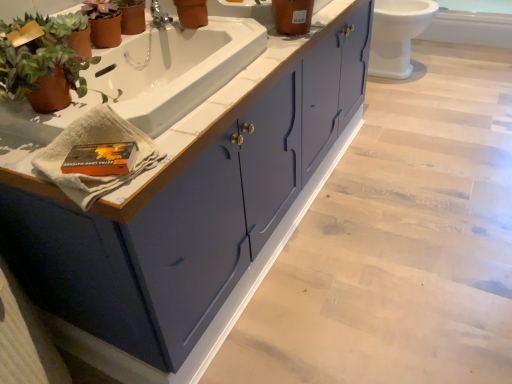
Question: Can you confirm if white glossy toilet at upper right is taller than matte orange pot at upper center?

Choices:
 (A) yes
 (B) no

Answer: (A)

Question: Is white glossy toilet at upper right not within matte orange pot at upper center?

Choices:
 (A) yes
 (B) no

Answer: (A)

Question: Is white glossy toilet at upper right shorter than matte orange pot at upper center?

Choices:
 (A) yes
 (B) no

Answer: (B)

Question: Does white glossy toilet at upper right have a smaller size compared to matte orange pot at upper center?

Choices:
 (A) yes
 (B) no

Answer: (B)

Question: Is white glossy toilet at upper right positioned with its back to matte orange pot at upper center?

Choices:
 (A) no
 (B) yes

Answer: (A)

Question: Considering the positions of white glossy sink at upper center and silver metallic faucet at upper center in the image, is white glossy sink at upper center taller or shorter than silver metallic faucet at upper center?

Choices:
 (A) tall
 (B) short

Answer: (A)

Question: Which is correct: white glossy sink at upper center is inside silver metallic faucet at upper center, or outside of it?

Choices:
 (A) outside
 (B) inside

Answer: (A)

Question: Based on their sizes in the image, would you say white glossy sink at upper center is bigger or smaller than silver metallic faucet at upper center?

Choices:
 (A) small
 (B) big

Answer: (B)

Question: From a real-world perspective, relative to silver metallic faucet at upper center, is white glossy sink at upper center vertically above or below?

Choices:
 (A) below
 (B) above

Answer: (A)

Question: Is matte blue cabinet at center taller or shorter than silver metallic faucet at upper center?

Choices:
 (A) tall
 (B) short

Answer: (A)

Question: Is matte blue cabinet at center situated inside silver metallic faucet at upper center or outside?

Choices:
 (A) inside
 (B) outside

Answer: (B)

Question: From a real-world perspective, relative to silver metallic faucet at upper center, is matte blue cabinet at center vertically above or below?

Choices:
 (A) above
 (B) below

Answer: (B)

Question: Is matte blue cabinet at center to the left or to the right of silver metallic faucet at upper center in the image?

Choices:
 (A) right
 (B) left

Answer: (A)

Question: Considering the relative positions of white glossy sink at upper center and matte blue cabinet at center in the image provided, is white glossy sink at upper center to the left or to the right of matte blue cabinet at center?

Choices:
 (A) right
 (B) left

Answer: (B)

Question: From a real-world perspective, relative to matte blue cabinet at center, is white glossy sink at upper center vertically above or below?

Choices:
 (A) above
 (B) below

Answer: (A)